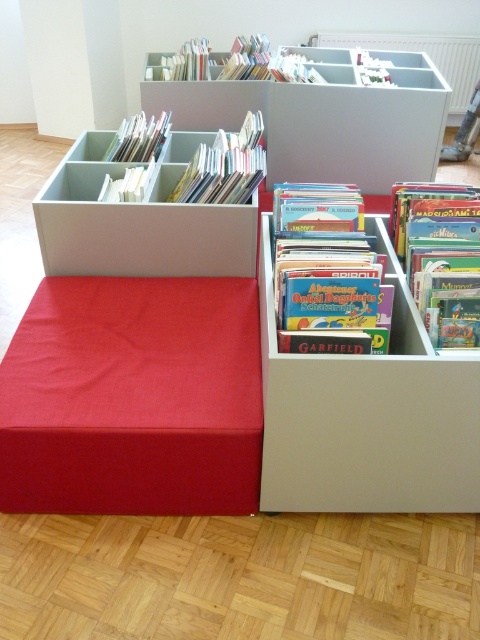
Does matte gray bookshelf at upper center come behind white paper book at upper center?

That is False.

Can you confirm if matte gray bookshelf at upper center is thinner than white paper book at upper center?

No, matte gray bookshelf at upper center is not thinner than white paper book at upper center.

Find the location of a particular element. matte gray bookshelf at upper center is located at coordinates (323, 116).

Locate an element on the screen. This screenshot has height=640, width=480. matte gray bookshelf at upper center is located at coordinates (323, 116).

Describe the element at coordinates (325, 272) in the screenshot. This screenshot has width=480, height=640. I see `hardcover book at center` at that location.

Measure the distance between hardcover book at center and camera.

They are 4.55 feet apart.

Identify the location of hardcover book at center. (325, 272).

Which of these two, matte plastic storage at center or white paper book at upper center, stands taller?

With more height is matte plastic storage at center.

Describe the element at coordinates (139, 220) in the screenshot. I see `matte plastic storage at center` at that location.

This screenshot has height=640, width=480. In order to click on matte plastic storage at center in this screenshot , I will do `click(139, 220)`.